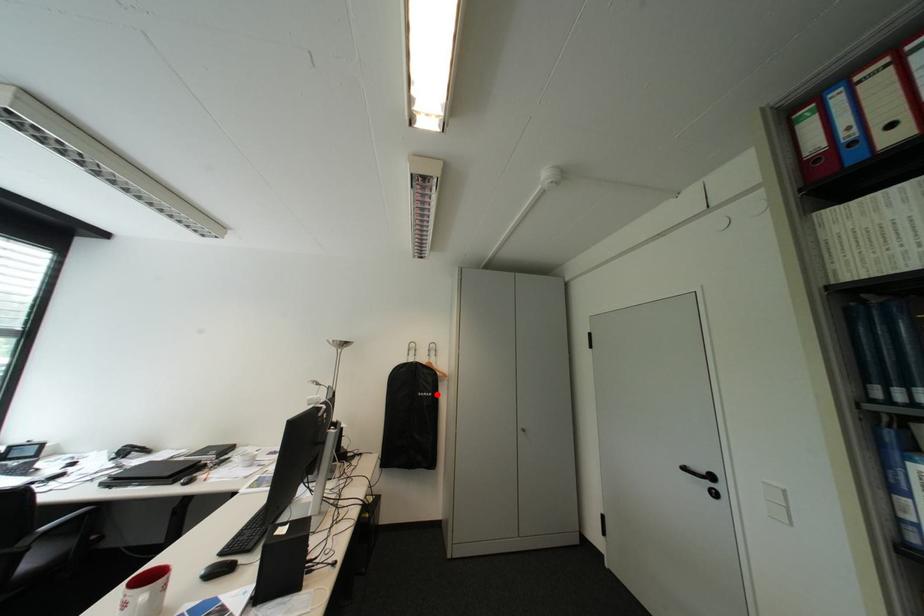
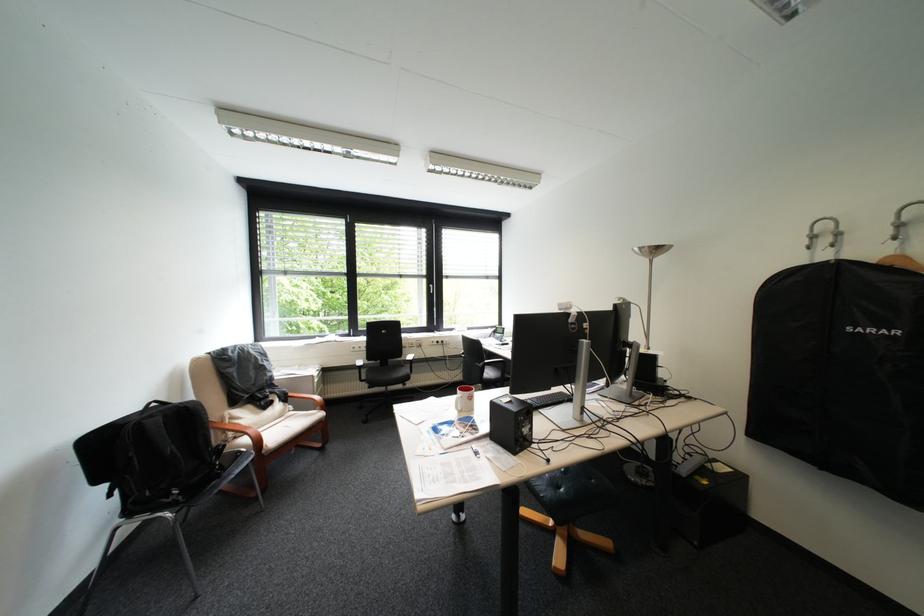
Question: I am providing you with two images of the same scene from different viewpoints. Given a red point in image1, look at the same physical point in image2. Is it:

Choices:
 (A) Closer to the viewpoint
 (B) Farther from the viewpoint

Answer: (A)